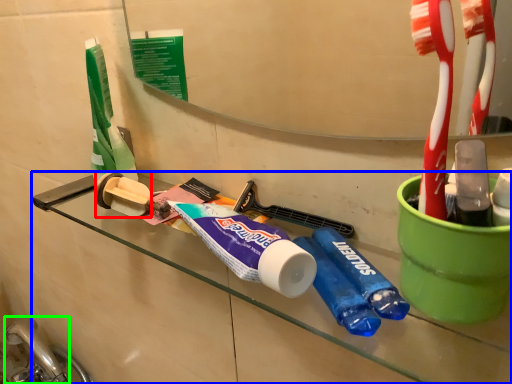
Question: Which object is the farthest from toilet paper (highlighted by a red box)? Choose among these: counter (highlighted by a blue box) or faucet (highlighted by a green box).

Choices:
 (A) counter
 (B) faucet

Answer: (B)